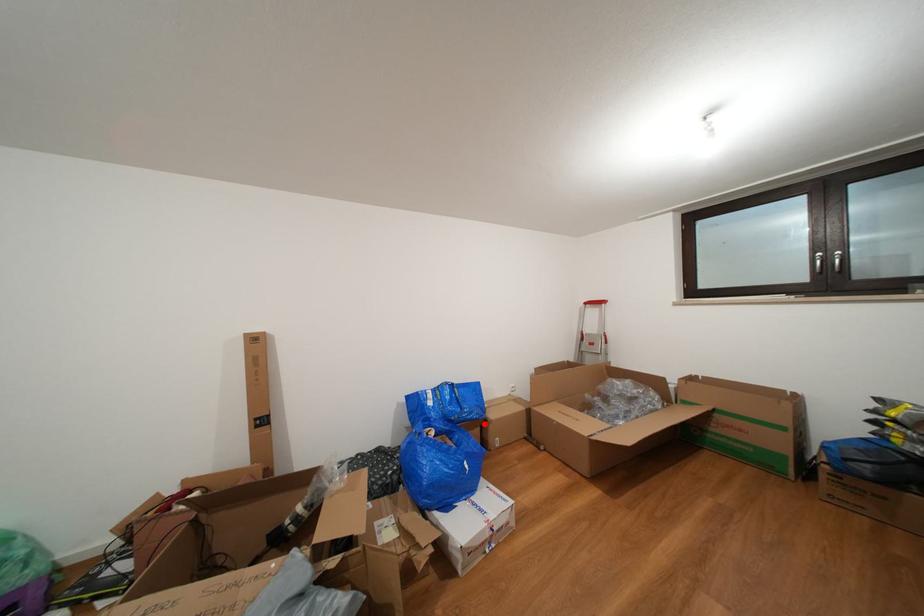
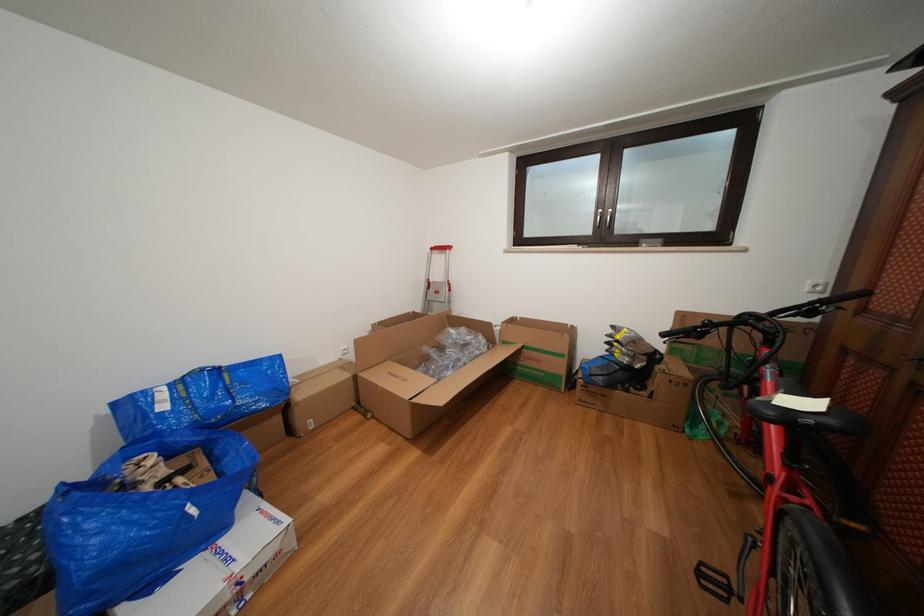
In the second image, find the point that corresponds to the highlighted location in the first image.

(274, 414)